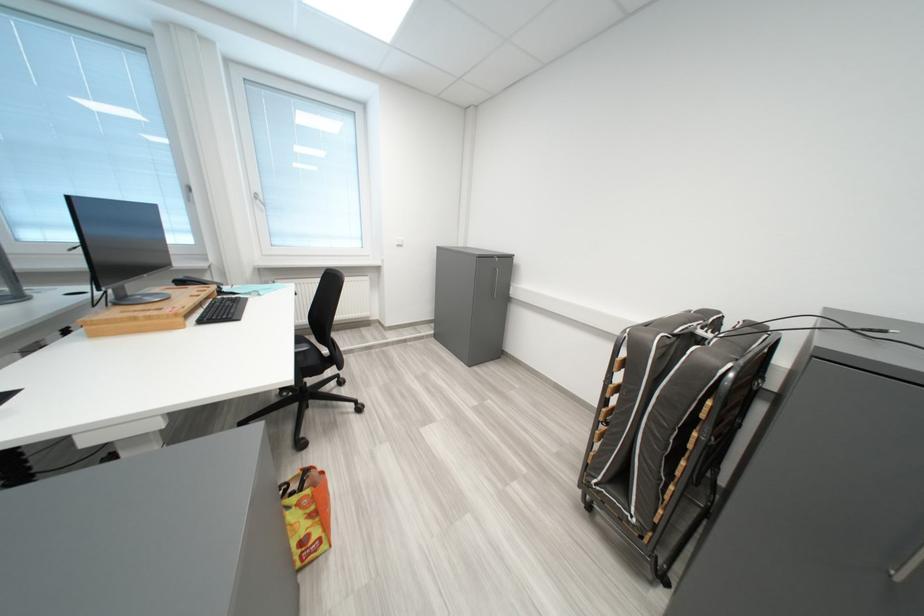
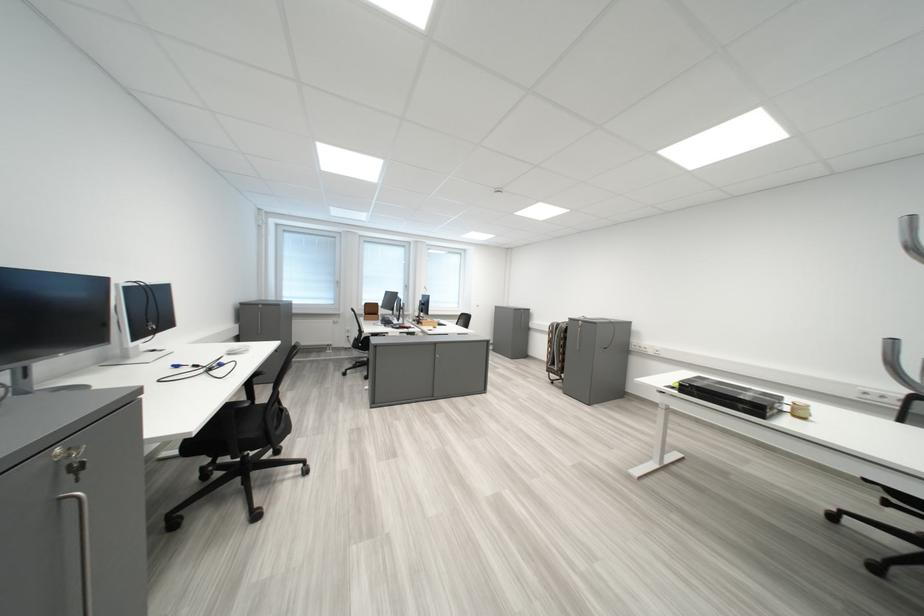
Question: In a continuous first-person perspective shot, in which direction is the camera moving?

Choices:
 (A) Left
 (B) Right
 (C) Forward
 (D) Backward

Answer: (D)